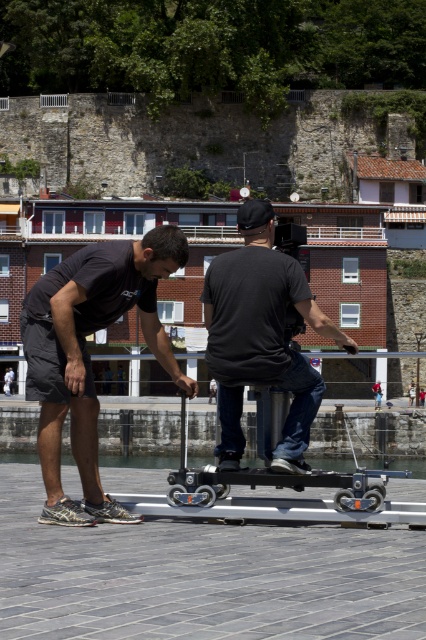
Is matte black skateboard at left positioned before black matte scooter at center?

Yes.

Who is more distant from viewer, [54,333] or [229,406]?

The point [229,406] is more distant.

This screenshot has width=426, height=640. What do you see at coordinates (88, 355) in the screenshot?
I see `matte black skateboard at left` at bounding box center [88, 355].

Image resolution: width=426 pixels, height=640 pixels. In order to click on matte black skateboard at left in this screenshot , I will do `click(88, 355)`.